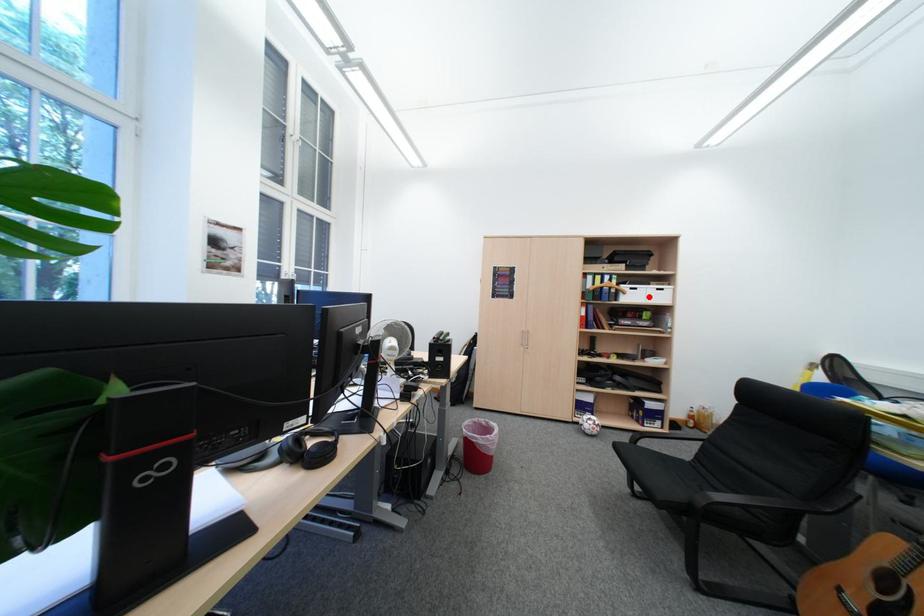
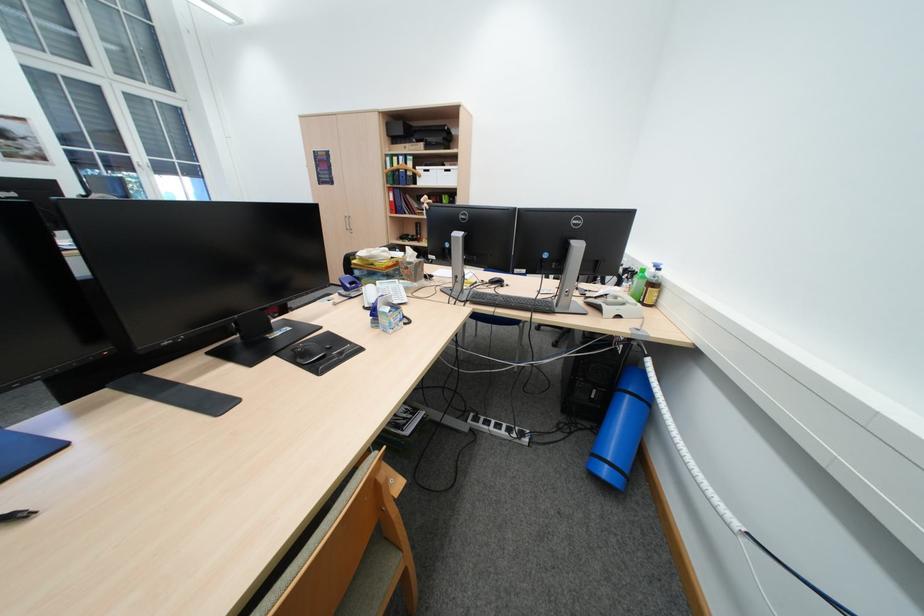
Find the pixel in the second image that matches the highlighted location in the first image.

(442, 179)